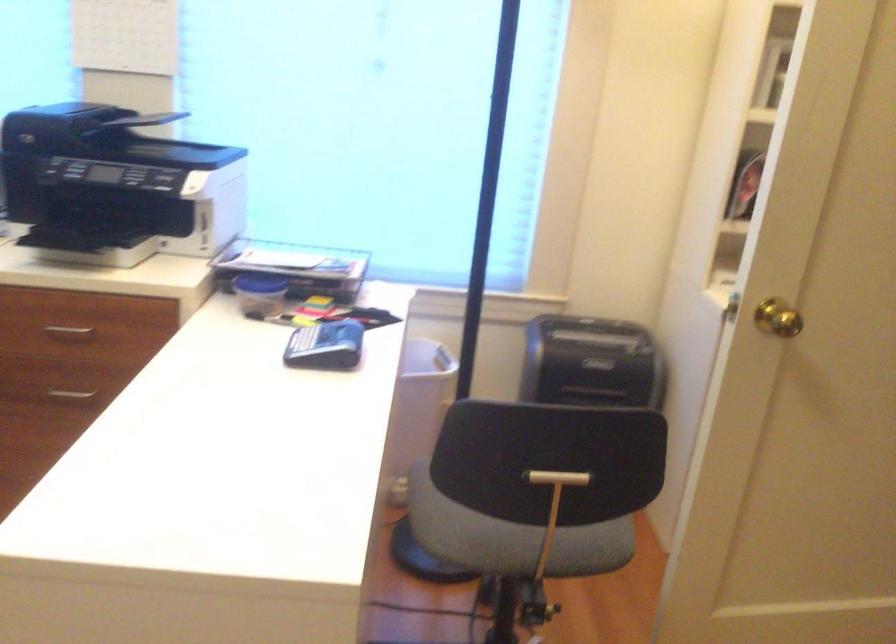
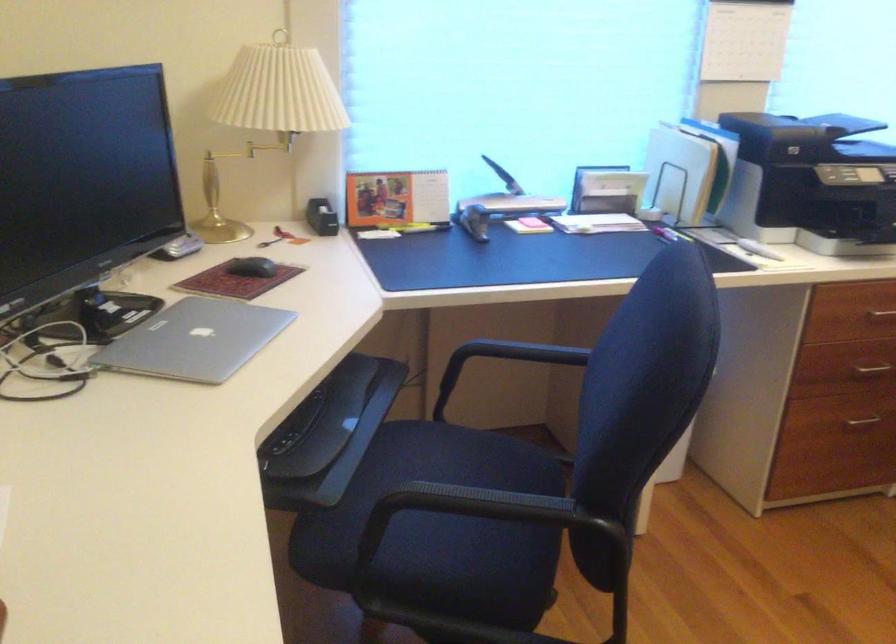
In the second image, find the point that corresponds to (x=85, y=397) in the first image.

(869, 370)